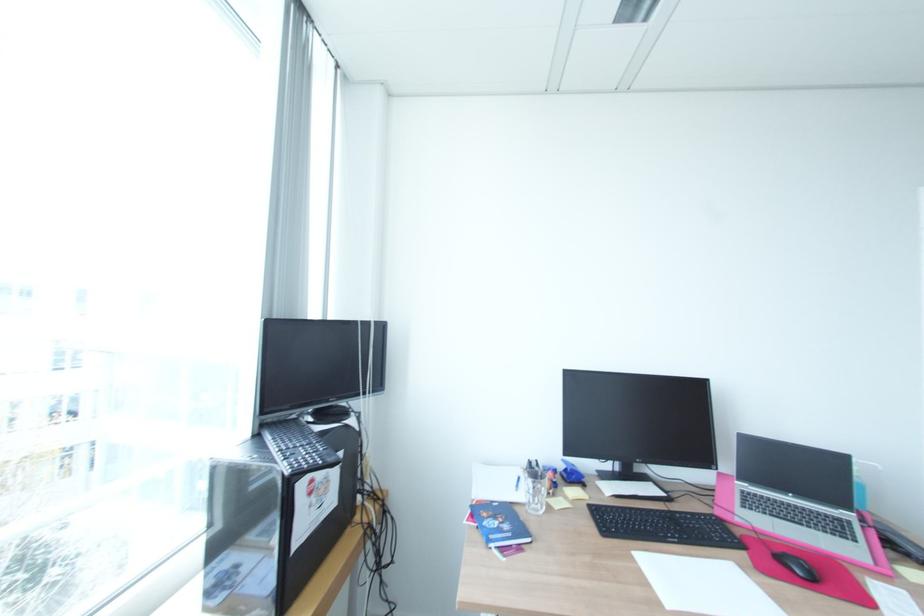
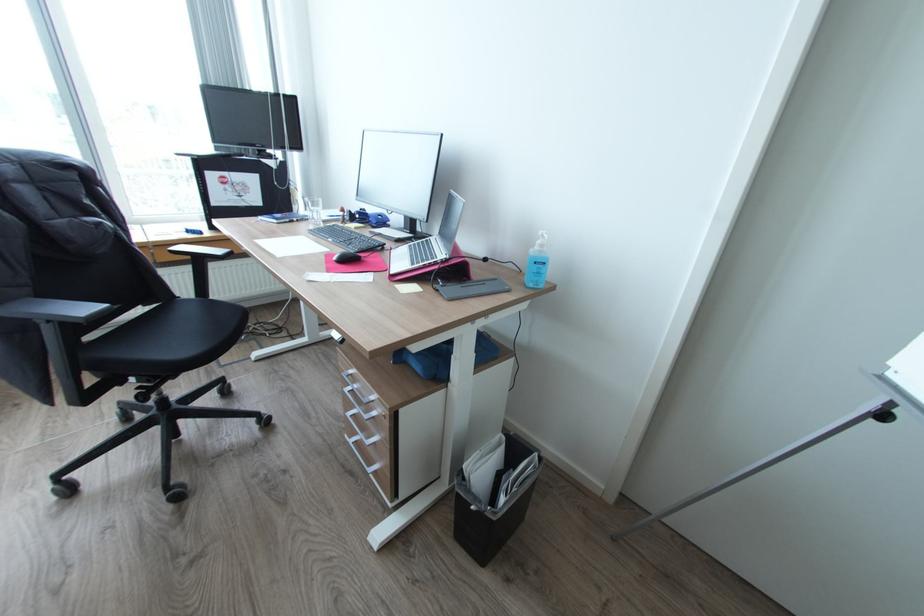
Question: I am providing you with two images of the same scene from different viewpoints. Which of the following objects are not visible in image2?

Choices:
 (A) black chair sitting surface
 (B) sanitizer pump top
 (C) silver drawer handle
 (D) none of these

Answer: (D)